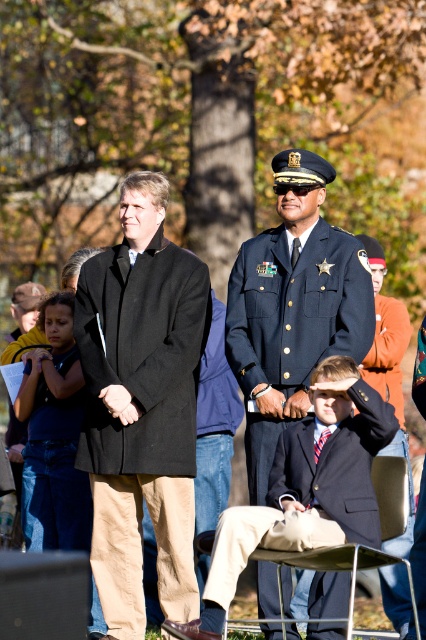
You are organizing a photo shoot and need to ensure that the light blue fabric uniform at center and dark blue suit at center are positioned so that their widths are visually balanced. Given their current widths, which one should you adjust to achieve this balance?

The light blue fabric uniform at center has a smaller width than the dark blue suit at center. To balance their widths, you should widen the light blue fabric uniform at center or narrow the dark blue suit at center.